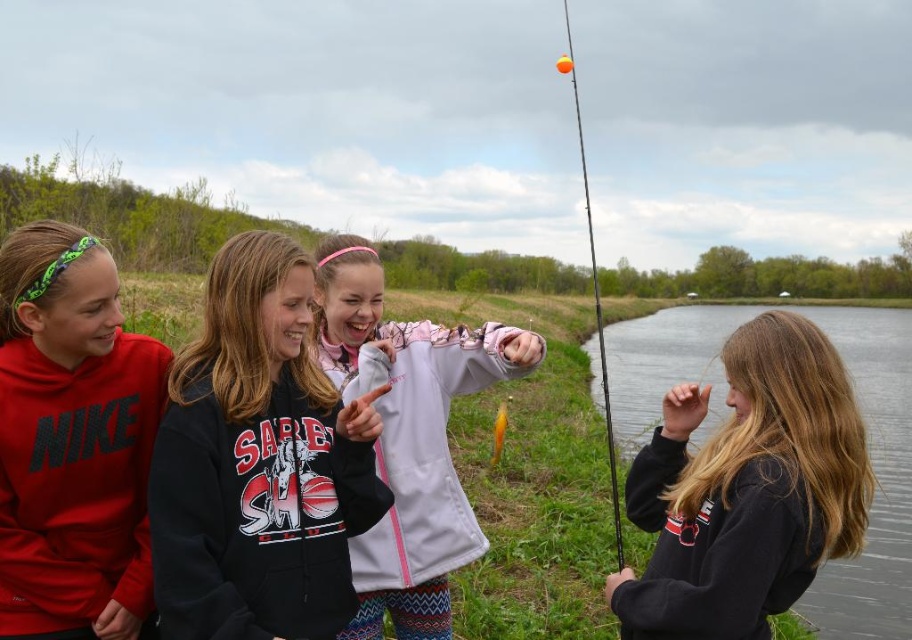
Question: Is matte red hoodie at left above white fleece jacket at center?

Choices:
 (A) yes
 (B) no

Answer: (A)

Question: Can you confirm if black fleece sweatshirt at center is positioned above black fleece sweatshirt at right?

Choices:
 (A) no
 (B) yes

Answer: (B)

Question: Which of these objects is positioned closest to the orange glossy fishing pole at upper right?

Choices:
 (A) matte red hoodie at left
 (B) black fleece sweatshirt at center
 (C) black fleece sweatshirt at right

Answer: (B)

Question: Does matte red hoodie at left have a greater width compared to white fleece jacket at center?

Choices:
 (A) yes
 (B) no

Answer: (B)

Question: Among these points, which one is nearest to the camera?

Choices:
 (A) (353, 273)
 (B) (201, 557)
 (C) (61, 250)
 (D) (565, 17)

Answer: (B)

Question: Which object is farther from the camera taking this photo?

Choices:
 (A) orange glossy fishing pole at upper right
 (B) black fleece sweatshirt at right
 (C) black fleece sweatshirt at center

Answer: (A)